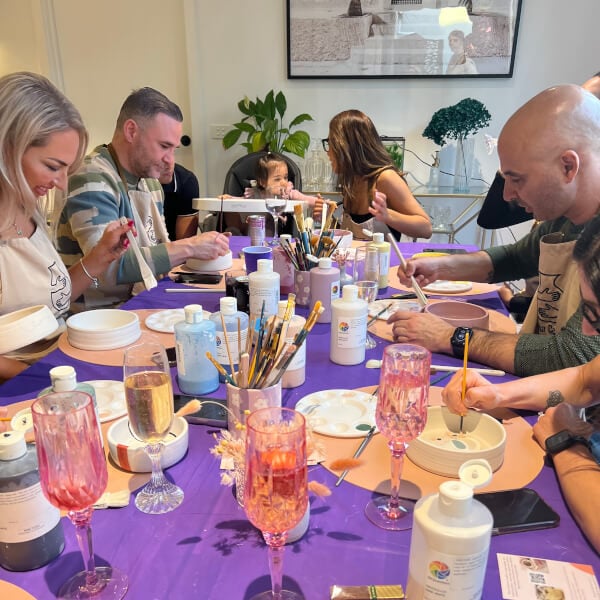
Locate an element on the screen. The width and height of the screenshot is (600, 600). glass is located at coordinates (68, 449), (146, 366), (271, 443), (410, 395), (365, 290), (363, 255).